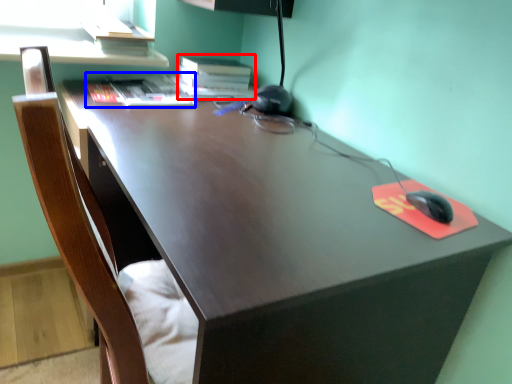
Question: Which point is further to the camera, book (highlighted by a red box) or book (highlighted by a blue box)?

Choices:
 (A) book
 (B) book

Answer: (A)